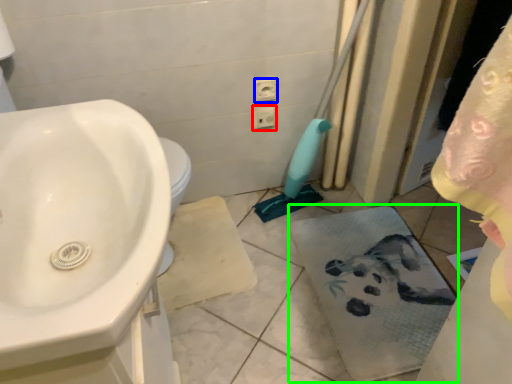
Question: Which object is the closest to the electric outlet (highlighted by a red box)? Choose among these: electric outlet (highlighted by a blue box) or bath towel (highlighted by a green box).

Choices:
 (A) electric outlet
 (B) bath towel

Answer: (A)